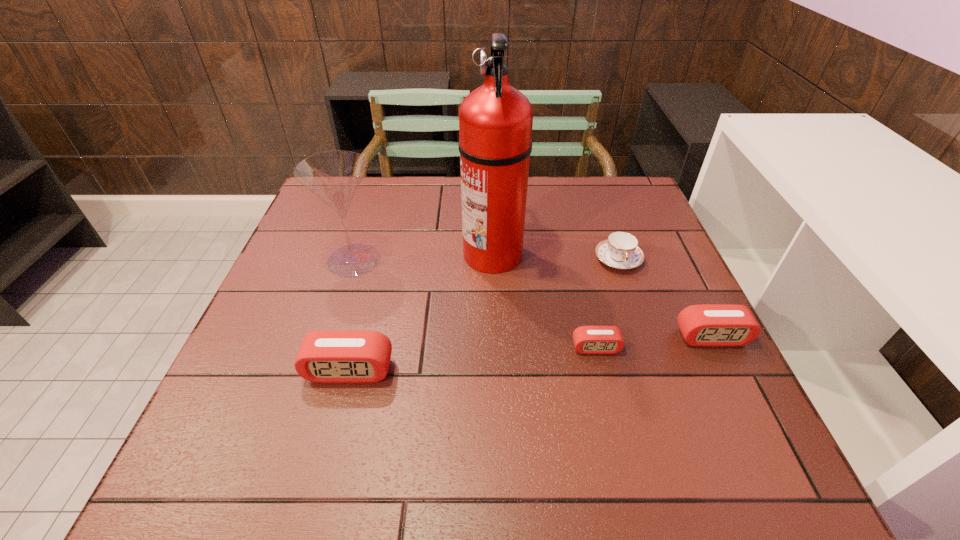
Locate an element on the screen. This screenshot has height=540, width=960. free region located 0.070m on the front-facing side of the second alarm clock from right to left is located at coordinates (605, 384).

Find the location of `vacant area situated on the front-facing side of the fourth tallest object`. vacant area situated on the front-facing side of the fourth tallest object is located at coordinates (749, 413).

Locate an element on the screen. free spot located at the nozzle of the tallest object is located at coordinates (427, 253).

This screenshot has width=960, height=540. I want to click on free region located 0.160m at the nozzle of the tallest object, so click(400, 253).

Identify the location of free point located at the nozzle of the tallest object. (362, 253).

At what (x,y) coordinates should I click in order to perform the action: click on vacant space located on the front of the fifth shortest object. Please return your answer as a coordinate pair (x, y). Looking at the image, I should click on (315, 383).

You are a GUI agent. You are given a task and a screenshot of the screen. Output one action in this format:
    pyautogui.click(x=<x>, y=<y>)
    Task: Click on the vacant region located on the side with the handle of the teacup
    
    Given the screenshot: What is the action you would take?
    (646, 339)

The width and height of the screenshot is (960, 540). I want to click on object that is at the near edge, so click(x=334, y=356).

Where is `alarm clock located at the left edge`? alarm clock located at the left edge is located at coordinates (334, 356).

At what (x,y) coordinates should I click in order to perform the action: click on flute glass at the left edge. Please return your answer as a coordinate pair (x, y). The image size is (960, 540). Looking at the image, I should click on (334, 176).